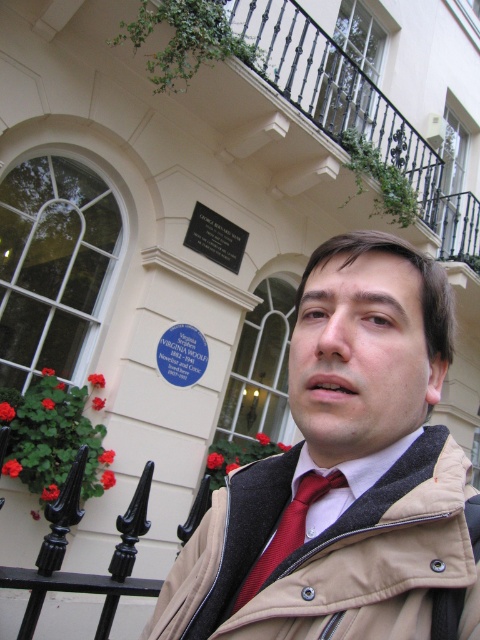
Question: Estimate the real-world distances between objects in this image. Which object is closer to the red satin tie at center?

Choices:
 (A) black polished stone plaque at upper center
 (B) red tie at center

Answer: (B)

Question: Among these objects, which one is nearest to the camera?

Choices:
 (A) red tie at center
 (B) red satin tie at center
 (C) black polished stone plaque at upper center

Answer: (A)

Question: Among these points, which one is farthest from the camera?

Choices:
 (A) (228, 621)
 (B) (216, 221)

Answer: (B)

Question: In this image, where is red tie at center located relative to red satin tie at center?

Choices:
 (A) below
 (B) above

Answer: (B)

Question: From the image, what is the correct spatial relationship of red tie at center in relation to black polished stone plaque at upper center?

Choices:
 (A) left
 (B) right

Answer: (B)

Question: Can you confirm if red tie at center is thinner than red satin tie at center?

Choices:
 (A) no
 (B) yes

Answer: (A)